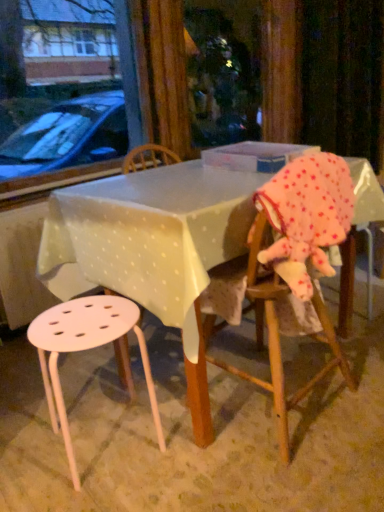
I want to click on vacant space in front of wooden chair at right, so 282,471.